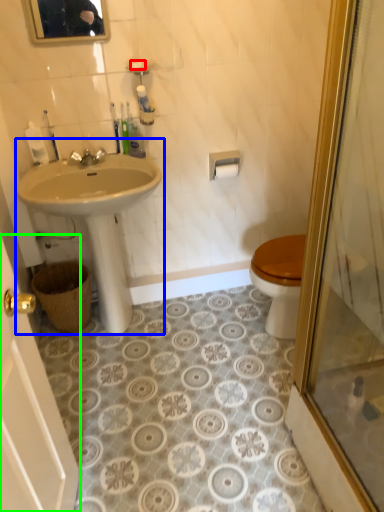
Question: Estimate the real-world distances between objects in this image. Which object is closer to soap (highlighted by a red box), sink (highlighted by a blue box) or screen door (highlighted by a green box)?

Choices:
 (A) sink
 (B) screen door

Answer: (A)